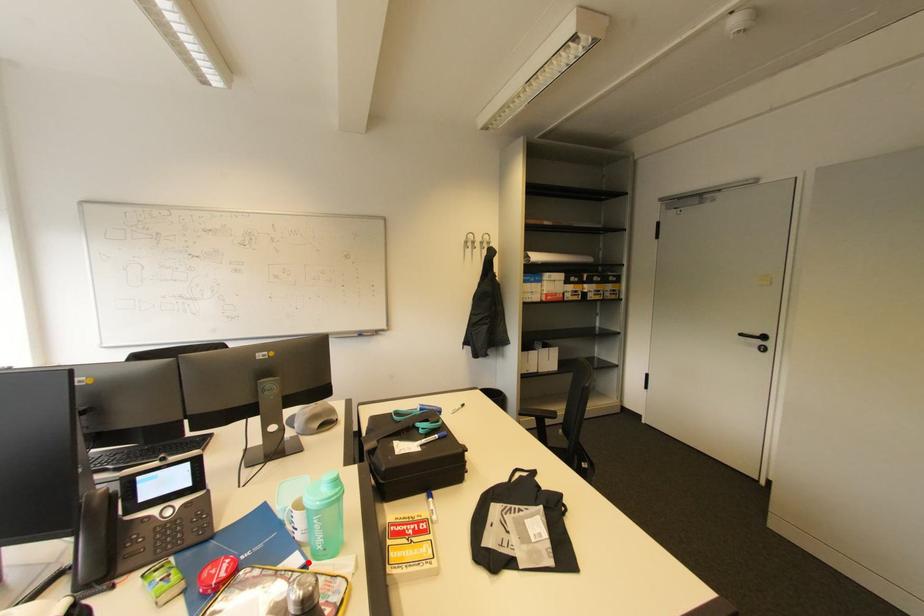
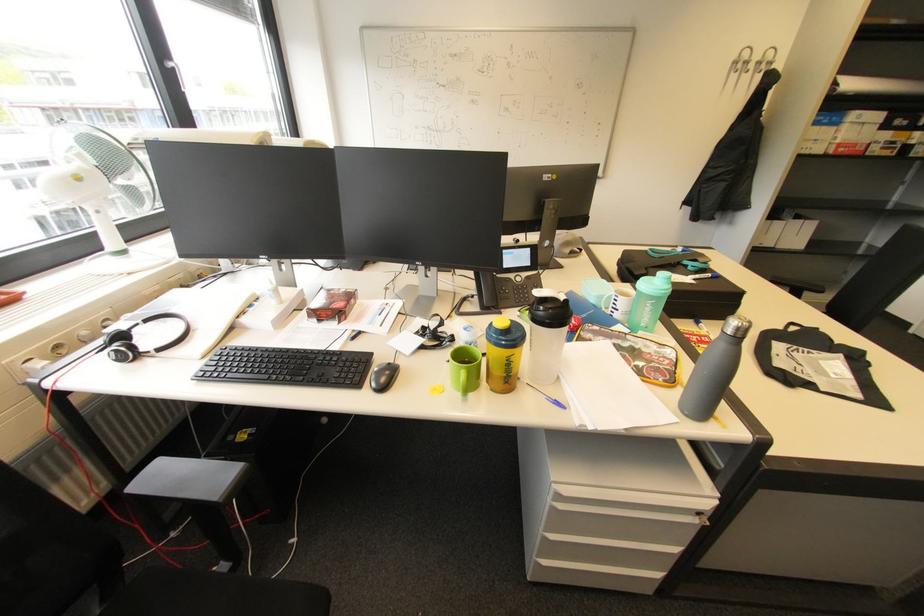
The point at the highlighted location is marked in the first image. Where is the corresponding point in the second image?

(635, 331)